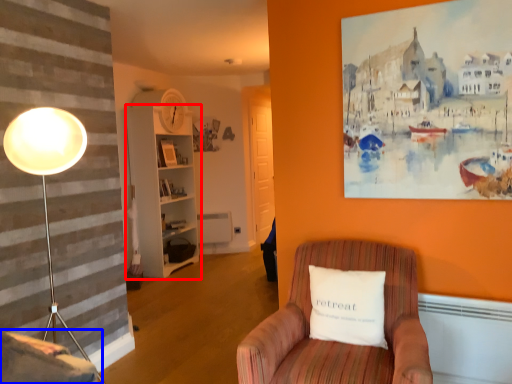
Question: Which point is closer to the camera, bookshelf (highlighted by a red box) or swivel chair (highlighted by a blue box)?

Choices:
 (A) bookshelf
 (B) swivel chair

Answer: (B)